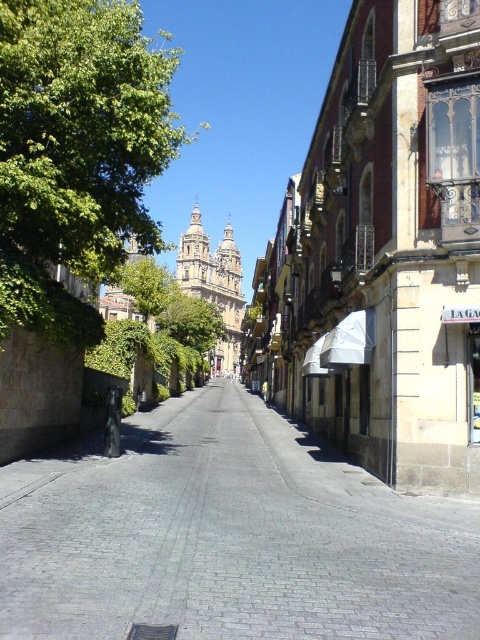
Question: Among these objects, which one is farthest from the camera?

Choices:
 (A) gray cobblestone pavement at center
 (B) green leafy tree at upper left

Answer: (B)

Question: Which point appears farthest from the camera in this image?

Choices:
 (A) (60, 230)
 (B) (260, 538)

Answer: (A)

Question: Which object is farther from the camera taking this photo?

Choices:
 (A) green leafy tree at upper left
 (B) gray cobblestone pavement at center

Answer: (A)

Question: Is gray cobblestone pavement at center to the right of green leafy tree at upper left from the viewer's perspective?

Choices:
 (A) no
 (B) yes

Answer: (B)

Question: Is gray cobblestone pavement at center bigger than green leafy tree at upper left?

Choices:
 (A) yes
 (B) no

Answer: (B)

Question: Observing the image, what is the correct spatial positioning of gray cobblestone pavement at center in reference to green leafy tree at upper left?

Choices:
 (A) below
 (B) above

Answer: (A)